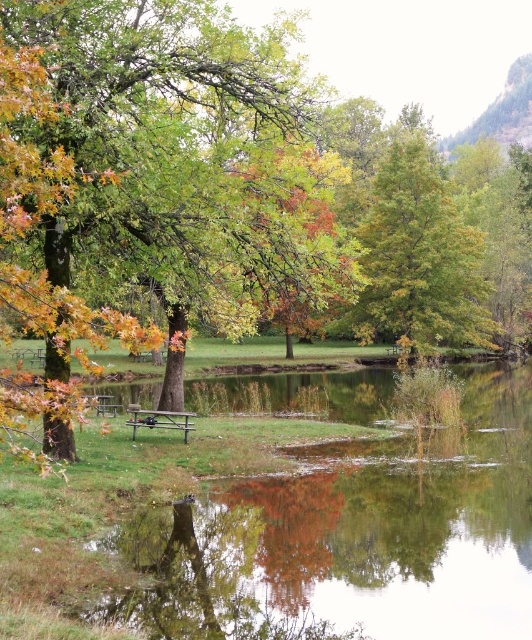
Question: Does green leafy tree at center appear on the left side of green matte tree at center?

Choices:
 (A) no
 (B) yes

Answer: (B)

Question: Which is farther from the brown wooden bench at center?

Choices:
 (A) green leafy tree at center
 (B) wooden park bench at center

Answer: (A)

Question: Which object is positioned closest to the green matte tree at center?

Choices:
 (A) green leafy tree at center
 (B) wooden park bench at center
 (C) brown wooden bench at center

Answer: (A)

Question: Where is green leafy tree at center located in relation to wooden park bench at center in the image?

Choices:
 (A) left
 (B) right

Answer: (B)

Question: Where is green leafy tree at center located in relation to brown wooden bench at center in the image?

Choices:
 (A) above
 (B) below

Answer: (A)

Question: Considering the real-world distances, which object is closest to the wooden park bench at center?

Choices:
 (A) green leafy tree at center
 (B) brown wooden bench at center

Answer: (A)